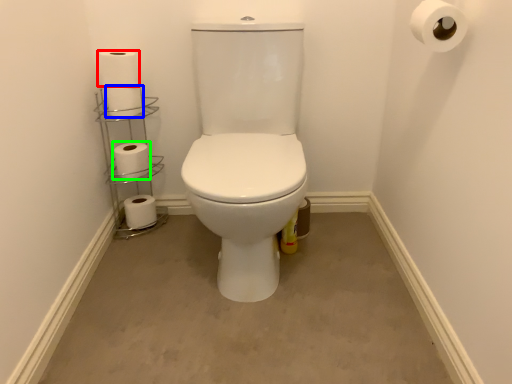
Question: Considering the real-world distances, which object is closest to toilet paper (highlighted by a red box)? toilet paper (highlighted by a blue box) or toilet paper (highlighted by a green box).

Choices:
 (A) toilet paper
 (B) toilet paper

Answer: (A)